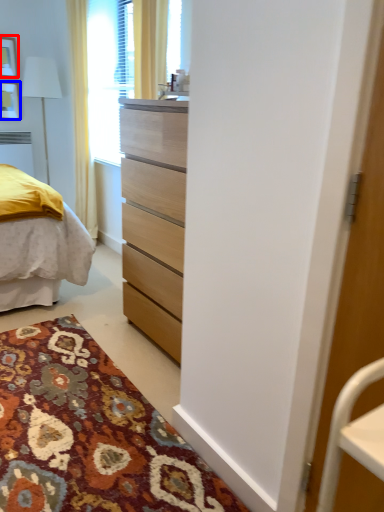
Question: Among these objects, which one is farthest to the camera, picture frame (highlighted by a red box) or picture frame (highlighted by a blue box)?

Choices:
 (A) picture frame
 (B) picture frame

Answer: (B)